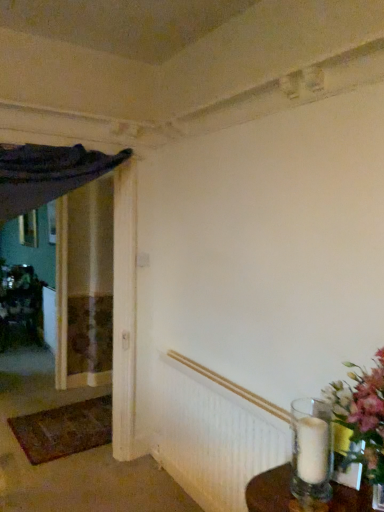
Question: Is white textured radiator at lower right placed right next to metallic silver vase at left?

Choices:
 (A) no
 (B) yes

Answer: (A)

Question: Can you confirm if white textured radiator at lower right is taller than metallic silver vase at left?

Choices:
 (A) no
 (B) yes

Answer: (A)

Question: Considering the relative sizes of white textured radiator at lower right and metallic silver vase at left in the image provided, is white textured radiator at lower right wider than metallic silver vase at left?

Choices:
 (A) no
 (B) yes

Answer: (A)

Question: Is white textured radiator at lower right turned away from metallic silver vase at left?

Choices:
 (A) no
 (B) yes

Answer: (A)

Question: Is white textured radiator at lower right further to camera compared to metallic silver vase at left?

Choices:
 (A) yes
 (B) no

Answer: (B)

Question: From a real-world perspective, is white textured radiator at lower right on top of metallic silver vase at left?

Choices:
 (A) yes
 (B) no

Answer: (A)

Question: Is clear glass vase at lower right thinner than metallic silver vase at left?

Choices:
 (A) yes
 (B) no

Answer: (A)

Question: From a real-world perspective, is clear glass vase at lower right below metallic silver vase at left?

Choices:
 (A) no
 (B) yes

Answer: (A)

Question: Does clear glass vase at lower right have a lesser height compared to metallic silver vase at left?

Choices:
 (A) no
 (B) yes

Answer: (B)

Question: Is clear glass vase at lower right far away from metallic silver vase at left?

Choices:
 (A) no
 (B) yes

Answer: (B)

Question: Is clear glass vase at lower right behind metallic silver vase at left?

Choices:
 (A) yes
 (B) no

Answer: (B)

Question: From the image's perspective, is clear glass vase at lower right below metallic silver vase at left?

Choices:
 (A) no
 (B) yes

Answer: (A)

Question: Can you confirm if clear glass vase at lower right is wider than brown woven mat at lower left?

Choices:
 (A) no
 (B) yes

Answer: (A)